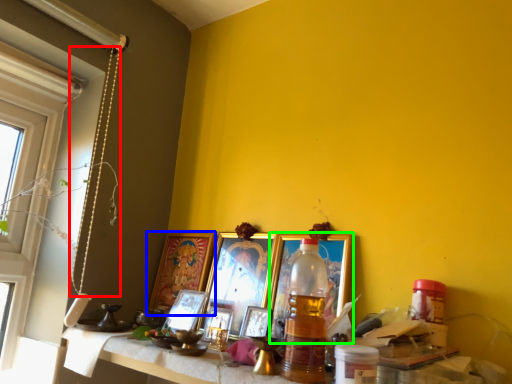
Question: Estimate the real-world distances between objects in this image. Which object is farther from string (highlighted by a red box), picture frame (highlighted by a blue box) or picture frame (highlighted by a green box)?

Choices:
 (A) picture frame
 (B) picture frame

Answer: (B)